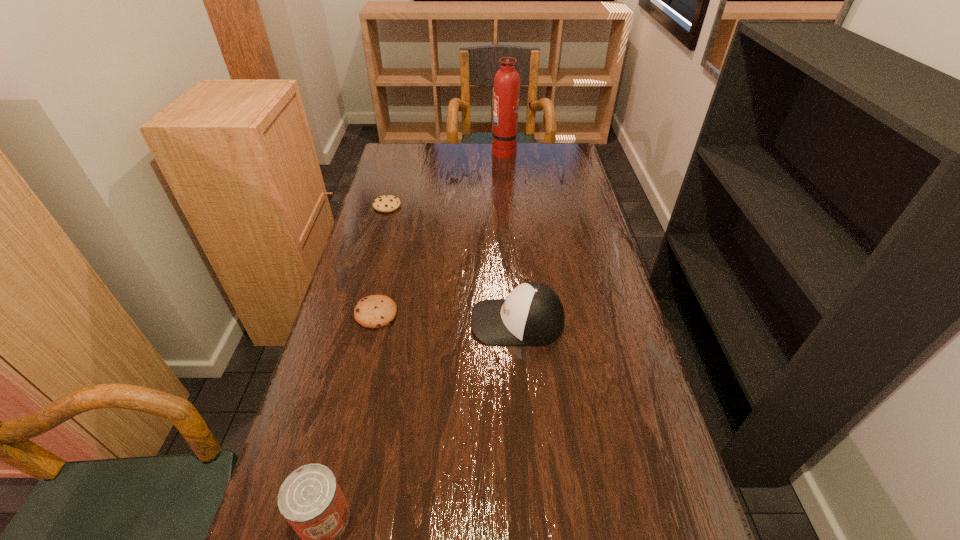
The width and height of the screenshot is (960, 540). In order to click on vacant space situated 0.090m on the front panel of the cap in this screenshot , I will do `click(436, 322)`.

Where is `vacant space located 0.150m on the back of the fourth nearest object`? The image size is (960, 540). vacant space located 0.150m on the back of the fourth nearest object is located at coordinates (396, 177).

Locate an element on the screen. vacant area situated on the front of the nearer cookie is located at coordinates (358, 391).

Identify the location of object that is at the far edge. click(x=507, y=80).

Where is `vacant space at the far edge of the desktop`? This screenshot has width=960, height=540. vacant space at the far edge of the desktop is located at coordinates (516, 170).

Identify the location of blank space at the left edge of the desktop. The image size is (960, 540). (398, 285).

Where is `free region at the right edge of the desktop`? free region at the right edge of the desktop is located at coordinates (557, 195).

Locate an element on the screen. The width and height of the screenshot is (960, 540). vacant space at the far left corner of the desktop is located at coordinates (389, 159).

Find the location of a particular element. free location at the far right corner is located at coordinates (540, 152).

Identify the location of empty location between the cap and the nearer cookie. (446, 318).